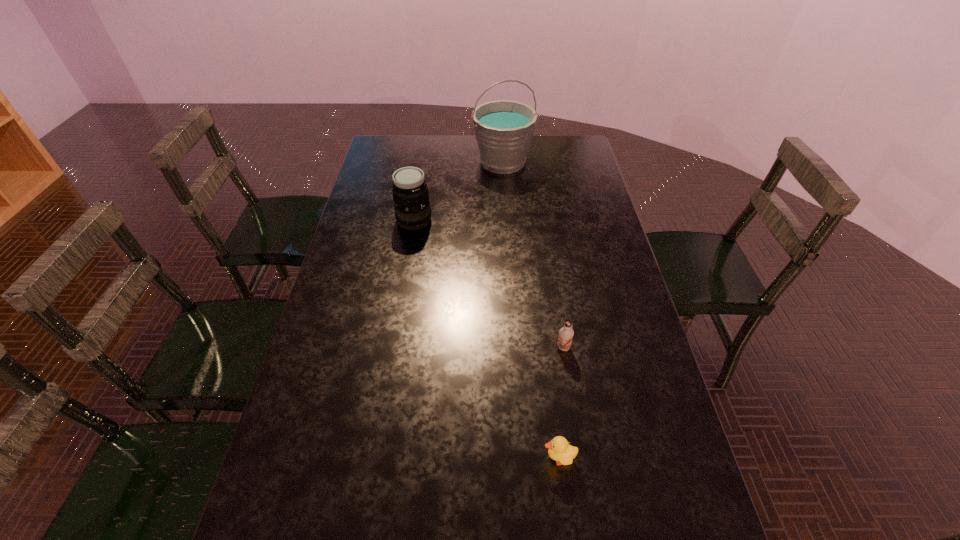
At what (x,y) coordinates should I click in order to perform the action: click on vacant space that is in between the chocolate milk and the nearest object. Please return your answer as a coordinate pair (x, y). Looking at the image, I should click on (561, 403).

Identify which object is the third nearest to the chocolate milk. Please provide its 2D coordinates. Your answer should be formatted as a tuple, i.e. [(x, y)], where the tuple contains the x and y coordinates of a point satisfying the conditions above.

[(504, 129)]

Identify which object is the third nearest to the second tallest object. Please provide its 2D coordinates. Your answer should be formatted as a tuple, i.e. [(x, y)], where the tuple contains the x and y coordinates of a point satisfying the conditions above.

[(559, 450)]

You are a GUI agent. You are given a task and a screenshot of the screen. Output one action in this format:
    pyautogui.click(x=<x>, y=<y>)
    Task: Click on the free space in the image that satisfies the following two spatial constraints: 1. on the front side of the third tallest object; 2. on the front-facing side of the nearest object
    This screenshot has height=540, width=960.
    Given the screenshot: What is the action you would take?
    pyautogui.click(x=581, y=458)